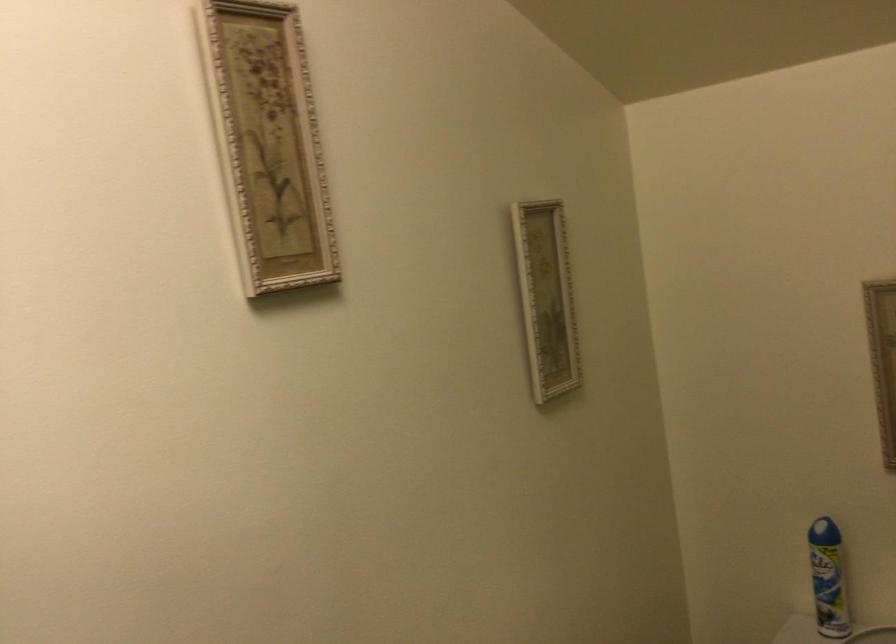
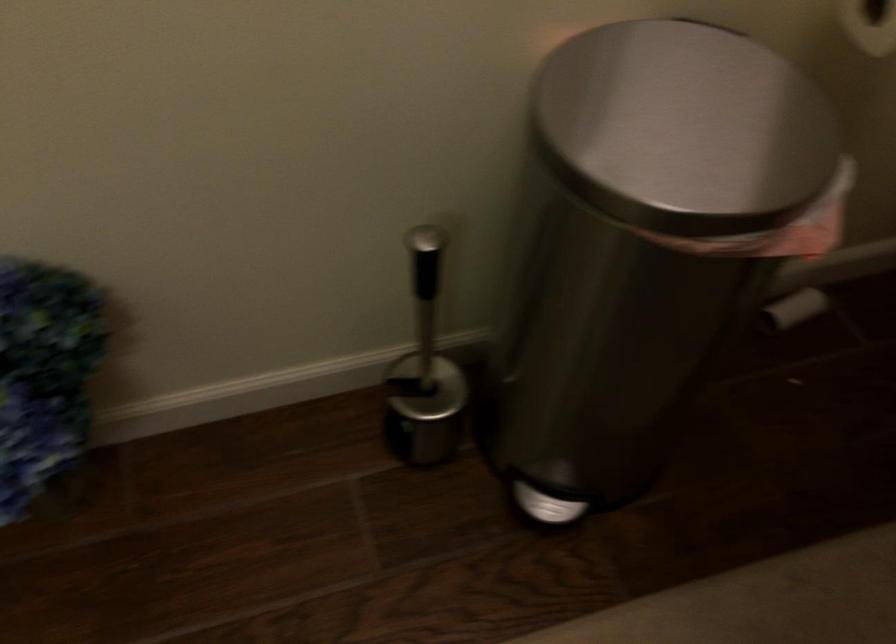
The first image is from the beginning of the video and the second image is from the end. How did the camera likely rotate when shooting the video?

The rotation direction of the camera is left-down.